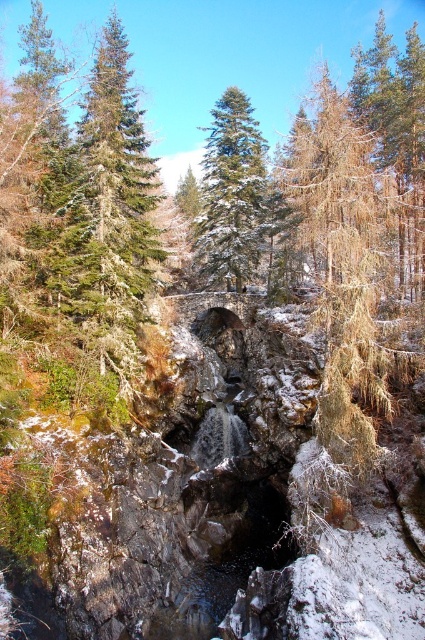
You are standing at the base of the rocky waterfall and want to take a photo of the green textured pine tree at upper left. If your camera has a maximum focus range of 20 meters, will it be able to capture the tree clearly?

The green textured pine tree at upper left is 18.05 meters away from the camera. Since this distance is within the camera maximum focus range of 20 meters, the camera can capture the tree clearly.

You are an environmental scientist assessing the forest health. You observe the green textured pine tree at upper left and the green matte evergreen tree at center. Which tree has a narrower trunk?

The green textured pine tree at upper left has a narrower trunk than the green matte evergreen tree at center.

You are a hiker looking for shelter from the cold wind. You see a green textured pine tree at upper left and a green matte evergreen tree at center. Which tree would provide better shelter from the wind?

The green textured pine tree at upper left is positioned under the green matte evergreen tree at center, so the green matte evergreen tree at center would provide better shelter from the wind as it is taller and blocks the wind first.